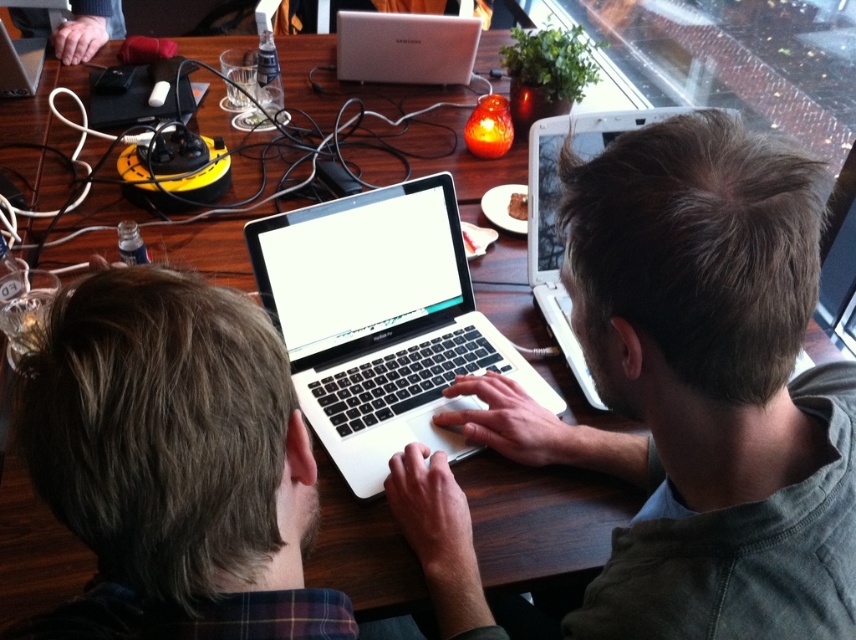
You are sitting at the wooden table in the image and want to reach both the point at coordinates point (476, 316) and the point at coordinates point (533, 160). Which point will you reach first if you extend your hand directly towards them?

You will reach point (476, 316) first because it is closer to you than point (533, 160), which is further away.

You are a barista trying to place a new drink order between the silver metallic laptop at upper center and the satin silver laptop at upper center on the table. Which laptop should you place the drink closer to if you want to avoid spilling on the laptop that is lower?

The silver metallic laptop at upper center is below the satin silver laptop at upper center. To avoid spilling on the lower laptop, place the drink closer to the satin silver laptop at upper center which is higher.